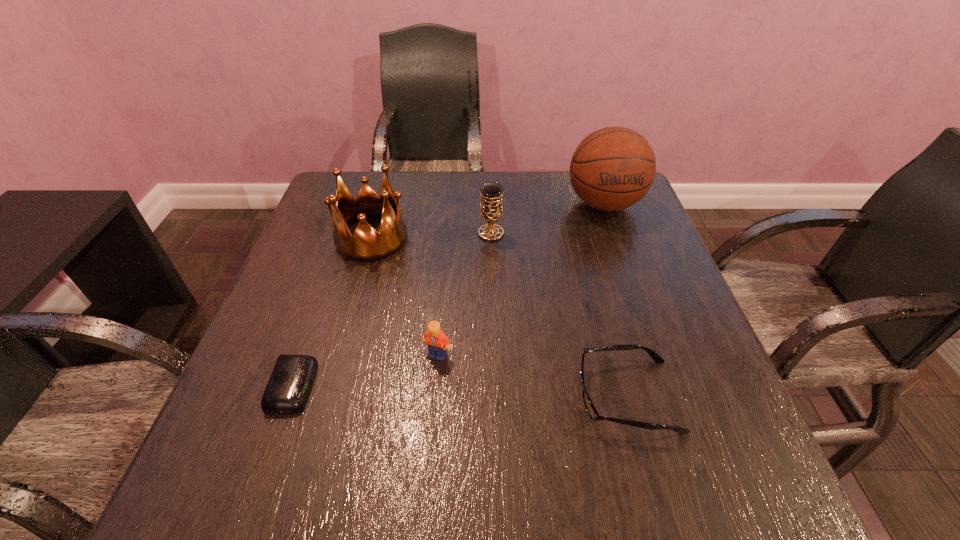
Identify the location of the fourth closest object to the chalice. (590, 408).

The width and height of the screenshot is (960, 540). Find the location of `free location that satisfies the following two spatial constraints: 1. on the side with brand label of the basketball; 2. on the front-facing side of the second shortest object`. free location that satisfies the following two spatial constraints: 1. on the side with brand label of the basketball; 2. on the front-facing side of the second shortest object is located at coordinates pyautogui.click(x=671, y=396).

Find the location of a particular element. free spot that satisfies the following two spatial constraints: 1. on the side with brand label of the tallest object; 2. on the front-facing side of the spectacles is located at coordinates (671, 396).

I want to click on vacant point that satisfies the following two spatial constraints: 1. on the front-facing side of the fourth object from right to left; 2. on the display of the shortest object, so tap(435, 386).